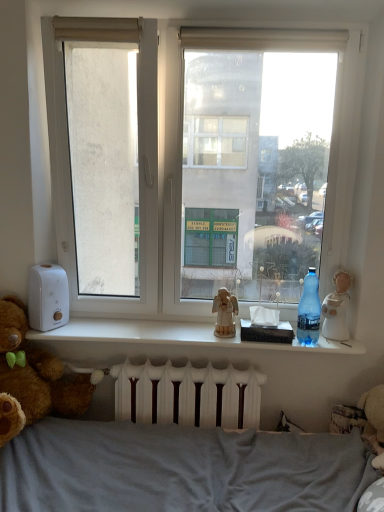
Question: From the image's perspective, is white matte window sill at center above or below white fabric curtain at upper center?

Choices:
 (A) below
 (B) above

Answer: (A)

Question: Is white matte window sill at center situated inside white fabric curtain at upper center or outside?

Choices:
 (A) inside
 (B) outside

Answer: (B)

Question: Which object is the closest to the white matte window sill at center?

Choices:
 (A) white ceramic figurine at right, which is the second figurine from left to right
 (B) white fabric curtain at upper center
 (C) transparent glass window at center
 (D) brown plush teddy bear at left
 (E) wooden angel at center, the second figurine from the right

Answer: (E)

Question: Which object is positioned closest to the transparent glass window at center?

Choices:
 (A) white ceramic figurine at right, the first figurine viewed from the right
 (B) white fabric curtain at upper center
 (C) blue plastic bottle at right
 (D) wooden angel at center, the second figurine from the right
 (E) brown plush teddy bear at left

Answer: (B)